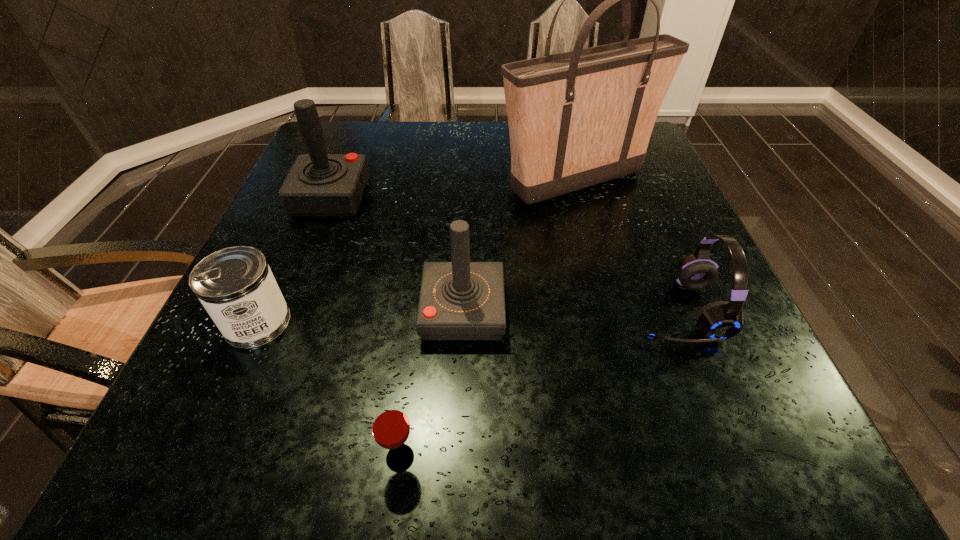
The height and width of the screenshot is (540, 960). I want to click on vacant space located 0.390m on the ear cushions of the headset, so click(x=420, y=310).

Locate an element on the screen. This screenshot has width=960, height=540. free spot located 0.320m on the ear cushions of the headset is located at coordinates (458, 310).

Where is `vacant space located 0.160m on the ear cushions of the headset`? The height and width of the screenshot is (540, 960). vacant space located 0.160m on the ear cushions of the headset is located at coordinates (545, 310).

This screenshot has width=960, height=540. What are the coordinates of `free region located on the right of the can` in the screenshot? It's located at pos(345,322).

The width and height of the screenshot is (960, 540). I want to click on blank area located 0.250m on the back of the glass, so click(x=419, y=308).

This screenshot has width=960, height=540. In order to click on object at the far edge in this screenshot , I will do `click(576, 119)`.

The width and height of the screenshot is (960, 540). Find the location of `object present at the near edge`. object present at the near edge is located at coordinates (390, 426).

The width and height of the screenshot is (960, 540). What are the coordinates of `joystick present at the left edge` in the screenshot? It's located at (319, 184).

The image size is (960, 540). I want to click on can positioned at the left edge, so tap(235, 285).

Where is `shopping bag at the right edge`? This screenshot has height=540, width=960. shopping bag at the right edge is located at coordinates (576, 119).